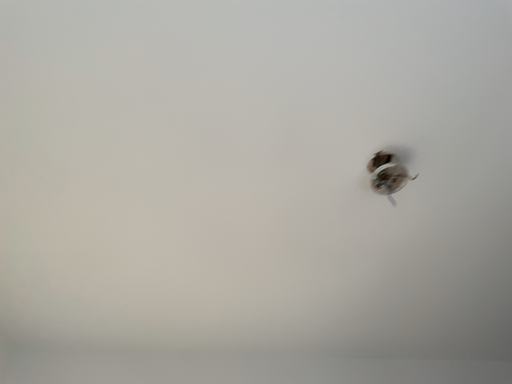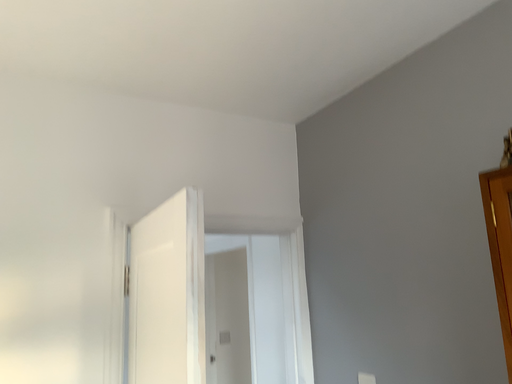
Question: How did the camera likely rotate when shooting the video?

Choices:
 (A) rotated downward
 (B) rotated upward

Answer: (A)